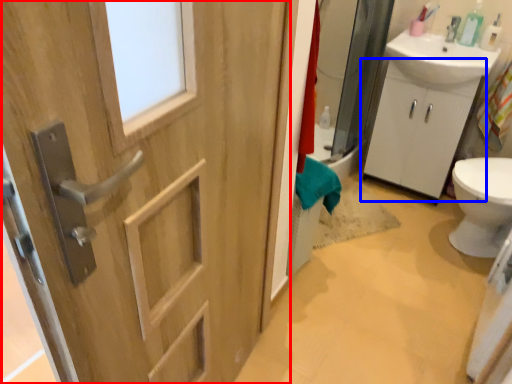
Question: Which point is closer to the camera, door (highlighted by a red box) or bathroom cabinet (highlighted by a blue box)?

Choices:
 (A) door
 (B) bathroom cabinet

Answer: (A)